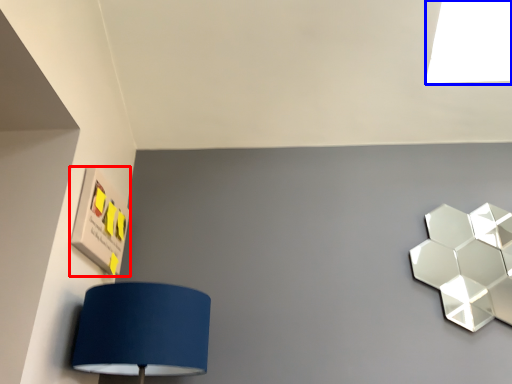
Question: Among these objects, which one is farthest to the camera, square (highlighted by a red box) or light (highlighted by a blue box)?

Choices:
 (A) square
 (B) light

Answer: (B)